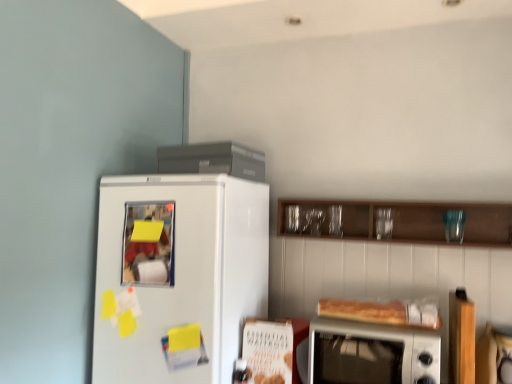
Question: Is silver metallic microwave oven at lower right bigger than white glossy refrigerator at left?

Choices:
 (A) no
 (B) yes

Answer: (A)

Question: Is silver metallic microwave oven at lower right positioned in front of white glossy refrigerator at left?

Choices:
 (A) yes
 (B) no

Answer: (A)

Question: From a real-world perspective, is silver metallic microwave oven at lower right under white glossy refrigerator at left?

Choices:
 (A) no
 (B) yes

Answer: (B)

Question: Considering the relative sizes of silver metallic microwave oven at lower right and white glossy refrigerator at left in the image provided, is silver metallic microwave oven at lower right wider than white glossy refrigerator at left?

Choices:
 (A) no
 (B) yes

Answer: (A)

Question: Does silver metallic microwave oven at lower right appear on the right side of white glossy refrigerator at left?

Choices:
 (A) yes
 (B) no

Answer: (A)

Question: Is silver metallic microwave oven at lower right facing away from white glossy refrigerator at left?

Choices:
 (A) no
 (B) yes

Answer: (A)

Question: Does wooden cabinet at upper center have a larger size compared to satin gray refrigerator at upper center?

Choices:
 (A) yes
 (B) no

Answer: (A)

Question: Is wooden cabinet at upper center aimed at satin gray refrigerator at upper center?

Choices:
 (A) no
 (B) yes

Answer: (A)

Question: Does wooden cabinet at upper center appear on the left side of satin gray refrigerator at upper center?

Choices:
 (A) no
 (B) yes

Answer: (A)

Question: Is wooden cabinet at upper center shorter than satin gray refrigerator at upper center?

Choices:
 (A) yes
 (B) no

Answer: (B)

Question: Is satin gray refrigerator at upper center a part of wooden cabinet at upper center?

Choices:
 (A) yes
 (B) no

Answer: (B)

Question: Considering the relative positions of wooden cabinet at upper center and satin gray refrigerator at upper center in the image provided, is wooden cabinet at upper center to the right of satin gray refrigerator at upper center from the viewer's perspective?

Choices:
 (A) no
 (B) yes

Answer: (B)

Question: Does satin gray refrigerator at upper center have a larger size compared to wooden cabinet at upper center?

Choices:
 (A) yes
 (B) no

Answer: (B)